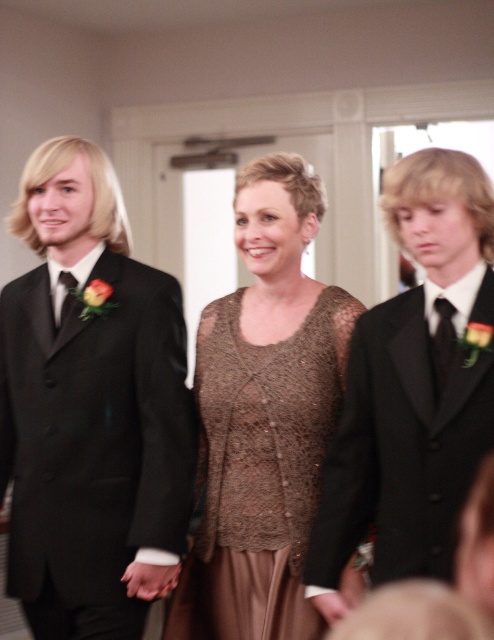
Question: Observing the image, what is the correct spatial positioning of black satin suit at right in reference to matte black tie at left?

Choices:
 (A) right
 (B) left

Answer: (A)

Question: Is matte black suit at left to the right of black satin suit at right from the viewer's perspective?

Choices:
 (A) no
 (B) yes

Answer: (A)

Question: Can you confirm if matte black suit at left is bigger than matte black tie at left?

Choices:
 (A) no
 (B) yes

Answer: (B)

Question: Which of the following is the closest to the observer?

Choices:
 (A) matte black suit at left
 (B) matte black tie at left
 (C) black satin tie at right

Answer: (C)

Question: Among these points, which one is farthest from the camera?

Choices:
 (A) (252, 492)
 (B) (453, 472)
 (C) (449, 340)

Answer: (A)

Question: Which point appears farthest from the camera in this image?

Choices:
 (A) pos(293,625)
 (B) pos(130,440)

Answer: (B)